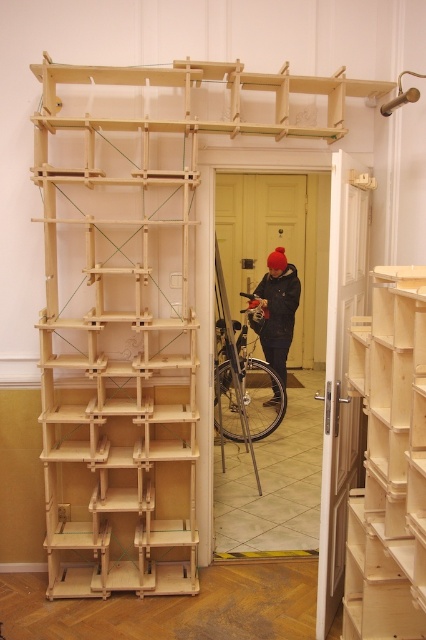
You are standing in the room and want to pick up an item from the pine wood shelves at right. However, there is a black rubber tire at center blocking your path. Can you reach the shelves without moving the tire?

The pine wood shelves at right is closer to the viewer than the black rubber tire at center, so you can reach the pine wood shelves at right without moving the tire since it is nearer to you than the tire.

You are a delivery person carrying a large package that is 2 meters long. You need to move it from the pine wood shelves at right to the black rubber tire at center. Is the space between them wide enough for the package to fit through?

The distance between the pine wood shelves at right and the black rubber tire at center is 2.41 meters, which is wider than the 2 meter length of the package. Therefore, the package can fit through the space between them.